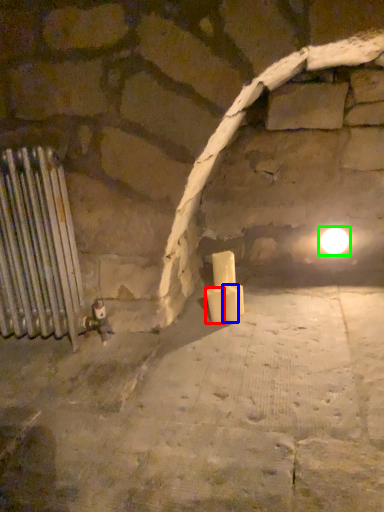
Question: Which is nearer to the candle (highlighted by a red box)? candle (highlighted by a blue box) or light (highlighted by a green box).

Choices:
 (A) candle
 (B) light

Answer: (A)